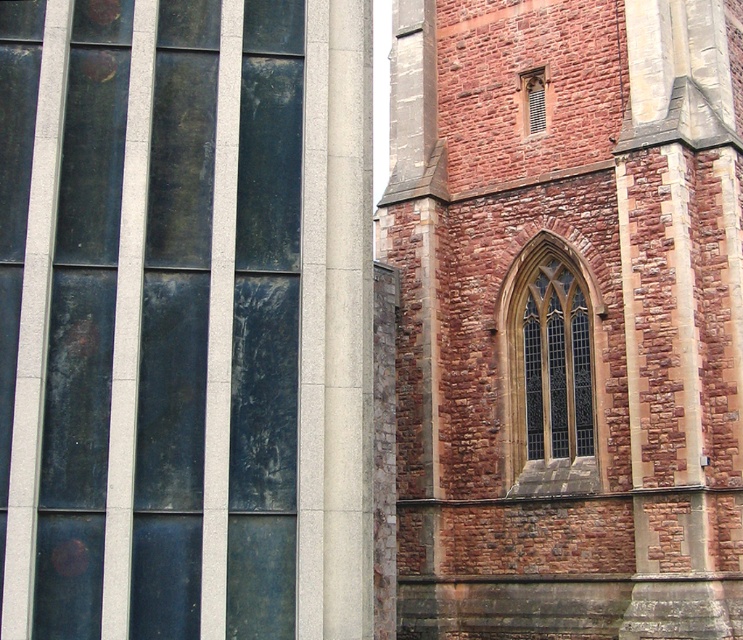
Question: Does reddish-brown stone tower at center-right have a lesser width compared to stained glass window at center?

Choices:
 (A) no
 (B) yes

Answer: (A)

Question: Does stained glass window at center appear on the left side of matte brick window at upper right?

Choices:
 (A) yes
 (B) no

Answer: (B)

Question: Among these points, which one is nearest to the camera?

Choices:
 (A) (525, 132)
 (B) (558, 243)
 (C) (690, 24)

Answer: (B)

Question: Which object is farther from the camera taking this photo?

Choices:
 (A) stained glass window at center
 (B) reddish-brown stone tower at center-right

Answer: (A)

Question: Can you confirm if stained glass window at center is thinner than matte brick window at upper right?

Choices:
 (A) yes
 (B) no

Answer: (B)

Question: Which point is farther from the camera taking this photo?

Choices:
 (A) (510, 451)
 (B) (678, 3)

Answer: (A)